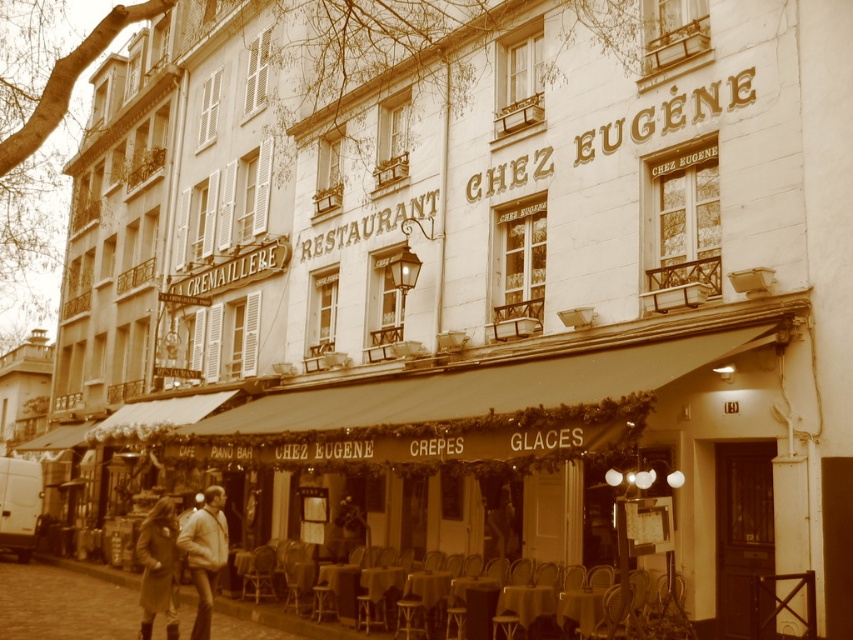
Looking at this image, between brown leather coat at lower left and light brown leather jacket at lower left, which one appears on the left side from the viewer's perspective?

Positioned to the left is brown leather coat at lower left.

Identify the location of brown leather coat at lower left. (158, 566).

What do you see at coordinates (158, 566) in the screenshot? I see `brown leather coat at lower left` at bounding box center [158, 566].

Locate an element on the screen. Image resolution: width=853 pixels, height=640 pixels. brown leather coat at lower left is located at coordinates (158, 566).

Find the location of a particular element. The height and width of the screenshot is (640, 853). metallic silver chair at lower center is located at coordinates (355, 586).

This screenshot has height=640, width=853. What do you see at coordinates (355, 586) in the screenshot?
I see `metallic silver chair at lower center` at bounding box center [355, 586].

This screenshot has width=853, height=640. Identify the location of metallic silver chair at lower center. (355, 586).

Does metallic silver chair at lower center have a greater width compared to light brown leather jacket at lower left?

Yes.

Is point (492, 573) closer to viewer compared to point (196, 568)?

No, (492, 573) is further to viewer.

At what (x,y) coordinates should I click in order to perform the action: click on metallic silver chair at lower center. Please return your answer as a coordinate pair (x, y). This screenshot has height=640, width=853. Looking at the image, I should click on (355, 586).